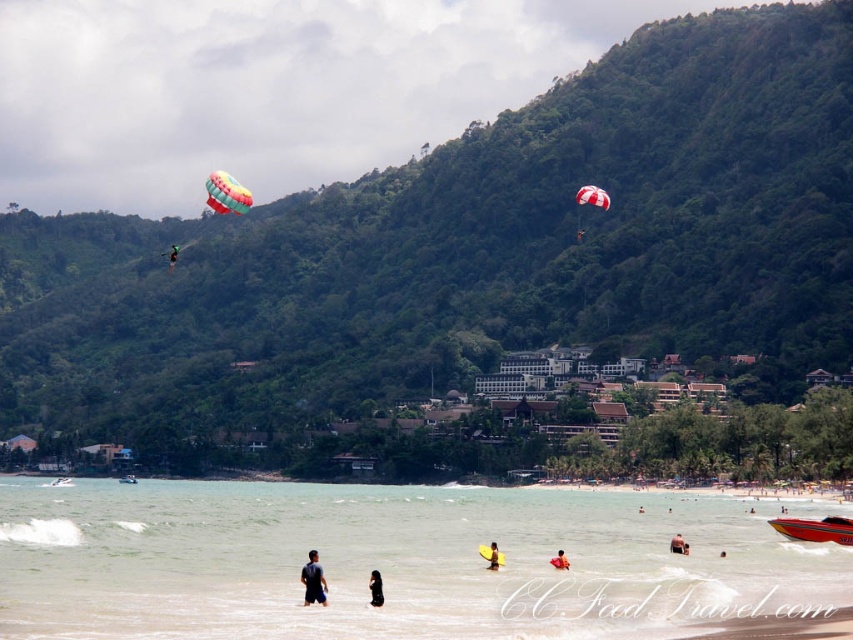
Which is above, orange foam board at lower center or green fabric parachute at upper left?

Positioned higher is green fabric parachute at upper left.

Locate an element on the screen. The width and height of the screenshot is (853, 640). orange foam board at lower center is located at coordinates (560, 561).

Is point (556, 568) less distant than point (169, 250)?

That is True.

Image resolution: width=853 pixels, height=640 pixels. Find the location of `orange foam board at lower center`. orange foam board at lower center is located at coordinates (560, 561).

Who is lower down, multicolored fabric parachute at upper center or tan skin human at lower center?

tan skin human at lower center is lower down.

Does multicolored fabric parachute at upper center appear on the right side of tan skin human at lower center?

Incorrect, multicolored fabric parachute at upper center is not on the right side of tan skin human at lower center.

Is point (219, 209) less distant than point (677, 544)?

No, (219, 209) is further to viewer.

Locate an element on the screen. multicolored fabric parachute at upper center is located at coordinates (225, 193).

Can you confirm if dark blue fabric shirt at lower center is smaller than yellow foam board at lower center?

No, dark blue fabric shirt at lower center is not smaller than yellow foam board at lower center.

In the scene shown: Is dark blue fabric shirt at lower center thinner than yellow foam board at lower center?

In fact, dark blue fabric shirt at lower center might be wider than yellow foam board at lower center.

Locate an element on the screen. The height and width of the screenshot is (640, 853). dark blue fabric shirt at lower center is located at coordinates (312, 580).